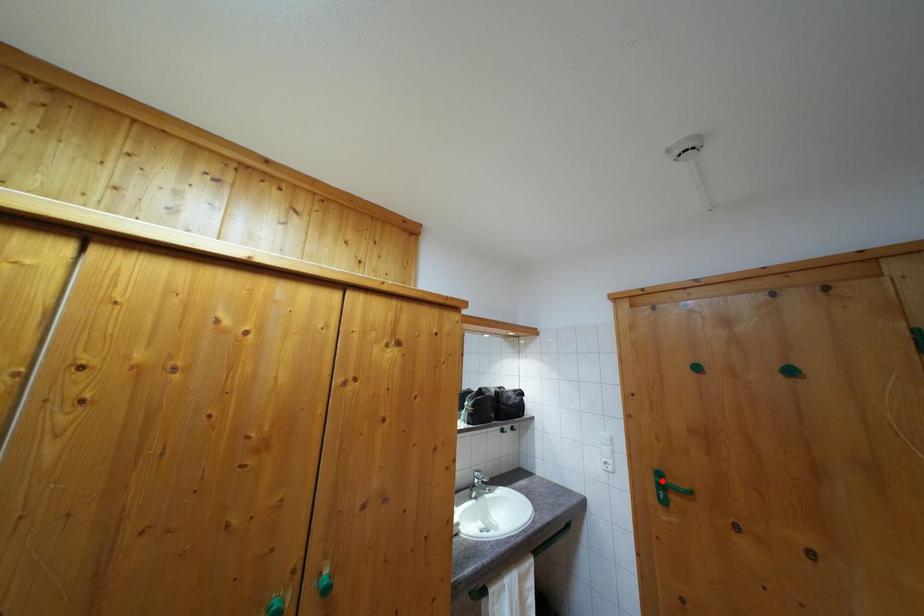
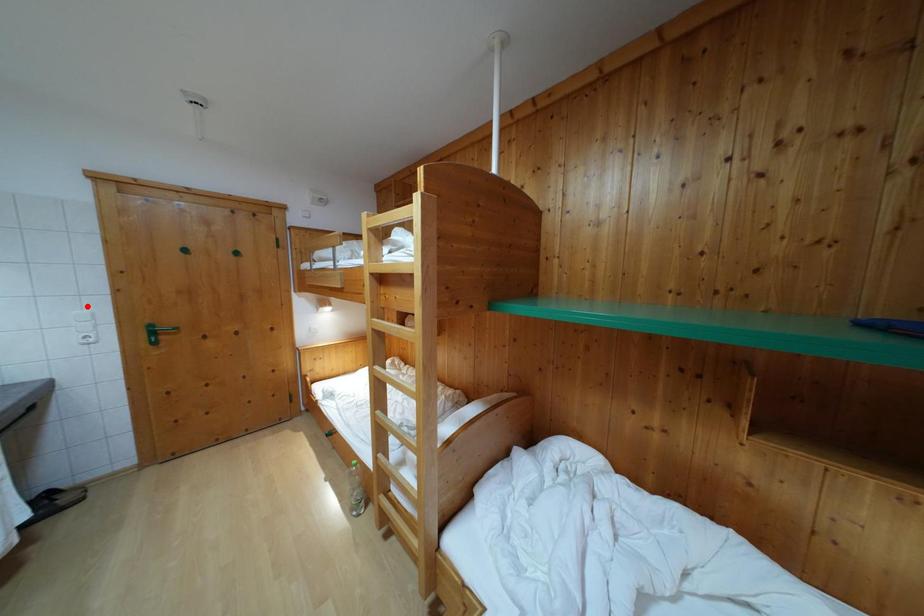
I am providing you with two images of the same scene from different viewpoints. A red point is marked on the first image and another point is marked on the second image. Do the highlighted points in image1 and image2 indicate the same real-world spot?

No